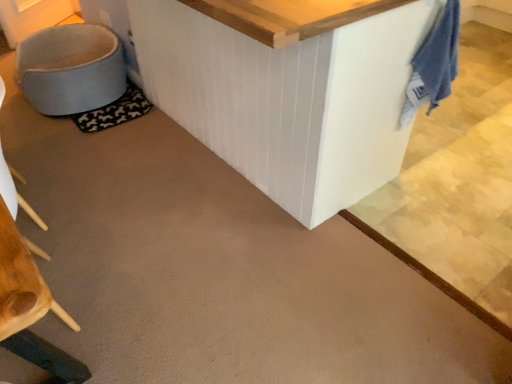
Describe the element at coordinates (70, 69) in the screenshot. I see `light blue fabric swivel chair at lower left` at that location.

What are the coordinates of `blue cotton towel at upper right` in the screenshot? It's located at (433, 65).

Where is `light blue fabric swivel chair at lower left`? The height and width of the screenshot is (384, 512). light blue fabric swivel chair at lower left is located at coordinates (70, 69).

Which of these two, light blue fabric swivel chair at lower left or blue cotton towel at upper right, is wider?

light blue fabric swivel chair at lower left.

Find the location of a particular element. Image resolution: width=512 pixels, height=384 pixels. laundry in front of the light blue fabric swivel chair at lower left is located at coordinates (433, 65).

Is the surface of light blue fabric swivel chair at lower left in direct contact with blue cotton towel at upper right?

Answer: No, light blue fabric swivel chair at lower left is not in contact with blue cotton towel at upper right.

Is point (74, 84) farther from viewer compared to point (454, 25)?

Yes, point (74, 84) is behind point (454, 25).

Could you tell me if blue cotton towel at upper right is turned towards light blue fabric swivel chair at lower left?

No, blue cotton towel at upper right is not facing towards light blue fabric swivel chair at lower left.

How many degrees apart are the facing directions of blue cotton towel at upper right and light blue fabric swivel chair at lower left?

5.36 degrees.

Does blue cotton towel at upper right touch light blue fabric swivel chair at lower left?

They are not placed beside each other.

Can you confirm if blue cotton towel at upper right is taller than light blue fabric swivel chair at lower left?

Correct, blue cotton towel at upper right is much taller as light blue fabric swivel chair at lower left.

From the picture: Measure the distance from black fabric mat at lower left to light blue fabric swivel chair at lower left.

black fabric mat at lower left is 9.75 inches from light blue fabric swivel chair at lower left.

Which of these two, black fabric mat at lower left or light blue fabric swivel chair at lower left, is thinner?

Thinner between the two is black fabric mat at lower left.

Is black fabric mat at lower left inside the boundaries of light blue fabric swivel chair at lower left, or outside?

The correct answer is: inside.

Is black fabric mat at lower left directly adjacent to blue cotton towel at upper right?

They are not placed beside each other.

Considering the sizes of objects black fabric mat at lower left and blue cotton towel at upper right in the image provided, who is wider, black fabric mat at lower left or blue cotton towel at upper right?

With larger width is black fabric mat at lower left.

Is black fabric mat at lower left positioned beyond the bounds of blue cotton towel at upper right?

Yes, black fabric mat at lower left is not within blue cotton towel at upper right.

From the image's perspective, is black fabric mat at lower left above or below blue cotton towel at upper right?

From the image's perspective, black fabric mat at lower left appears above blue cotton towel at upper right.

Considering the relative positions of blue cotton towel at upper right and black fabric mat at lower left in the image provided, is blue cotton towel at upper right to the right of black fabric mat at lower left from the viewer's perspective?

Indeed, blue cotton towel at upper right is positioned on the right side of black fabric mat at lower left.

From a real-world perspective, which object rests below the other?

black fabric mat at lower left.

Is black fabric mat at lower left located within blue cotton towel at upper right?

No, blue cotton towel at upper right does not contain black fabric mat at lower left.

Between blue cotton towel at upper right and black fabric mat at lower left, which one is positioned behind?

black fabric mat at lower left is more distant.

From the picture: Considering the sizes of objects light blue fabric swivel chair at lower left and black fabric mat at lower left in the image provided, who is smaller, light blue fabric swivel chair at lower left or black fabric mat at lower left?

Smaller between the two is black fabric mat at lower left.

Where is `mat on the right of the light blue fabric swivel chair at lower left`? mat on the right of the light blue fabric swivel chair at lower left is located at coordinates (115, 111).

Is the depth of light blue fabric swivel chair at lower left greater than that of black fabric mat at lower left?

No, light blue fabric swivel chair at lower left is in front of black fabric mat at lower left.

From a real-world perspective, is light blue fabric swivel chair at lower left beneath black fabric mat at lower left?

No, from a real-world perspective, light blue fabric swivel chair at lower left is not below black fabric mat at lower left.

Find the location of `swivel chair that is on the left side of blue cotton towel at upper right`. swivel chair that is on the left side of blue cotton towel at upper right is located at coordinates (70, 69).

Locate an element on the screen. This screenshot has width=512, height=384. laundry located on the right of light blue fabric swivel chair at lower left is located at coordinates (433, 65).

From the image, which object appears to be nearer to light blue fabric swivel chair at lower left, black fabric mat at lower left or blue cotton towel at upper right?

The object closer to light blue fabric swivel chair at lower left is black fabric mat at lower left.

Considering their positions, is blue cotton towel at upper right positioned further to black fabric mat at lower left than light blue fabric swivel chair at lower left?

blue cotton towel at upper right is positioned further to the anchor black fabric mat at lower left.

Based on their spatial positions, is blue cotton towel at upper right or black fabric mat at lower left closer to light blue fabric swivel chair at lower left?

black fabric mat at lower left.

Estimate the real-world distances between objects in this image. Which object is closer to blue cotton towel at upper right, black fabric mat at lower left or light blue fabric swivel chair at lower left?

black fabric mat at lower left is positioned closer to the anchor blue cotton towel at upper right.

From the picture: Looking at the image, which one is located further to blue cotton towel at upper right, light blue fabric swivel chair at lower left or black fabric mat at lower left?

The object further to blue cotton towel at upper right is light blue fabric swivel chair at lower left.

When comparing their distances from black fabric mat at lower left, does light blue fabric swivel chair at lower left or blue cotton towel at upper right seem further?

The object further to black fabric mat at lower left is blue cotton towel at upper right.

The height and width of the screenshot is (384, 512). What are the coordinates of `mat located between light blue fabric swivel chair at lower left and blue cotton towel at upper right in the left-right direction` in the screenshot? It's located at (115, 111).